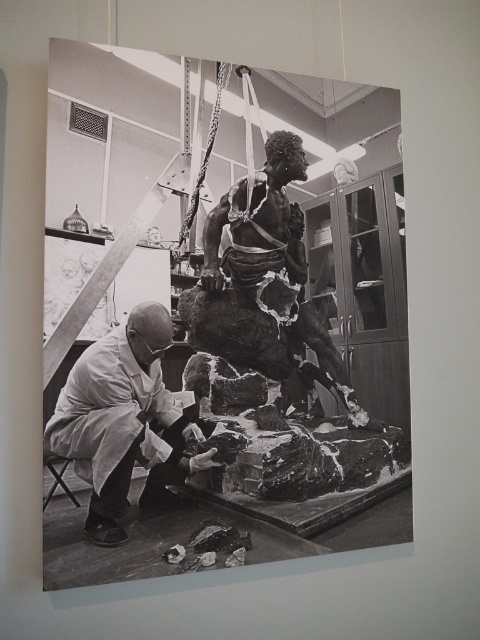
Question: In this image, where is white lab coat at lower left located relative to rough stone statue at center?

Choices:
 (A) above
 (B) below

Answer: (B)

Question: Considering the relative positions of white lab coat at lower left and rough stone statue at center in the image provided, where is white lab coat at lower left located with respect to rough stone statue at center?

Choices:
 (A) right
 (B) left

Answer: (B)

Question: Does white lab coat at lower left have a lesser width compared to rough stone statue at center?

Choices:
 (A) no
 (B) yes

Answer: (B)

Question: Which of the following is the closest to the observer?

Choices:
 (A) (242, 269)
 (B) (144, 387)

Answer: (B)